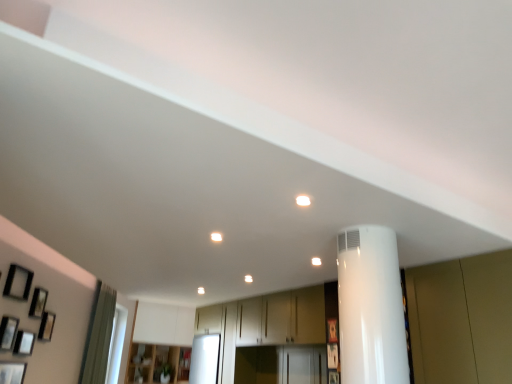
The width and height of the screenshot is (512, 384). What are the coordinates of `white glossy water heater at right` in the screenshot? It's located at (371, 308).

What do you see at coordinates (332, 330) in the screenshot? I see `wooden picture frame at center, which is the first picture frame from right to left` at bounding box center [332, 330].

In order to click on wooden picture frame at center, which is the first picture frame from right to left in this screenshot , I will do `click(332, 330)`.

What do you see at coordinates (18, 282) in the screenshot? I see `matte black picture frame at left, the 6th picture frame viewed from the left` at bounding box center [18, 282].

At what (x,y) coordinates should I click in order to perform the action: click on matte black picture frame at lower left, placed as the 1th picture frame when sorted from left to right. Please return your answer as a coordinate pair (x, y). This screenshot has height=384, width=512. Looking at the image, I should click on (12, 372).

You are a GUI agent. You are given a task and a screenshot of the screen. Output one action in this format:
    pyautogui.click(x=<x>, y=<y>)
    Task: Click on the white glossy water heater at right
    
    Given the screenshot: What is the action you would take?
    pyautogui.click(x=371, y=308)

Is white glossy water heater at right wider or thinner than matte black picture frame at left, which is the fourth picture frame in left-to-right order?

Considering their sizes, white glossy water heater at right looks broader than matte black picture frame at left, which is the fourth picture frame in left-to-right order.

Looking at this image, is white glossy water heater at right next to matte black picture frame at left, which is the fourth picture frame in left-to-right order?

white glossy water heater at right and matte black picture frame at left, which is the fourth picture frame in left-to-right order, are clearly separated.

Image resolution: width=512 pixels, height=384 pixels. What are the coordinates of `water heater in front of the matte black picture frame at left, which is the fourth picture frame in left-to-right order` in the screenshot? It's located at (371, 308).

Measure the distance between white glossy water heater at right and matte black picture frame at left, which is the fourth picture frame in left-to-right order.

A distance of 7.65 feet exists between white glossy water heater at right and matte black picture frame at left, which is the fourth picture frame in left-to-right order.

In the image, is wooden picture frame at lower left, arranged as the second picture frame when viewed from the left, positioned in front of or behind white glossy water heater at right?

Clearly, wooden picture frame at lower left, arranged as the second picture frame when viewed from the left, is behind white glossy water heater at right.

Could you tell me if wooden picture frame at lower left, arranged as the 7th picture frame when viewed from the right, is facing white glossy water heater at right?

Yes, wooden picture frame at lower left, arranged as the 7th picture frame when viewed from the right, faces towards white glossy water heater at right.

From the picture: From the image's perspective, does wooden picture frame at lower left, arranged as the 7th picture frame when viewed from the right, appear higher than white glossy water heater at right?

No, from the image's perspective, wooden picture frame at lower left, arranged as the 7th picture frame when viewed from the right, is not on top of white glossy water heater at right.

Based on their sizes in the image, would you say wooden picture frame at lower left, arranged as the 7th picture frame when viewed from the right, is bigger or smaller than white glossy water heater at right?

Clearly, wooden picture frame at lower left, arranged as the 7th picture frame when viewed from the right, is smaller in size than white glossy water heater at right.

The width and height of the screenshot is (512, 384). What are the coordinates of `the 1st picture frame below when counting from the wooden picture frame at lower left, arranged as the second picture frame when viewed from the left (from the image's perspective)` in the screenshot? It's located at (x=332, y=330).

Is wooden picture frame at lower left, arranged as the 7th picture frame when viewed from the right, oriented towards wooden picture frame at center, which is the eighth picture frame from left to right?

Yes, wooden picture frame at lower left, arranged as the 7th picture frame when viewed from the right, is turned towards wooden picture frame at center, which is the eighth picture frame from left to right.

Which of these two, wooden picture frame at lower left, arranged as the 7th picture frame when viewed from the right, or wooden picture frame at center, which is the first picture frame from right to left, stands taller?

Standing taller between the two is wooden picture frame at lower left, arranged as the 7th picture frame when viewed from the right.

Can you confirm if wooden picture frame at lower left, arranged as the 7th picture frame when viewed from the right, is positioned to the left of wooden picture frame at center, which is the eighth picture frame from left to right?

Yes.

Between matte black picture frame at left, which is the fourth picture frame in left-to-right order, and wooden cabinet at center, which one has larger width?

wooden cabinet at center.

Is wooden cabinet at center completely or partially inside matte black picture frame at left, acting as the fifth picture frame starting from the right?

That's incorrect, wooden cabinet at center is not inside matte black picture frame at left, acting as the fifth picture frame starting from the right.

Is matte black picture frame at left, acting as the fifth picture frame starting from the right, taller or shorter than wooden cabinet at center?

In the image, matte black picture frame at left, acting as the fifth picture frame starting from the right, appears to be shorter than wooden cabinet at center.

In the scene shown: Considering the relative sizes of matte black picture frame at lower left, placed as the 1th picture frame when sorted from left to right, and wooden picture frame at lower right, which appears as the second picture frame when viewed from the right, in the image provided, is matte black picture frame at lower left, placed as the 1th picture frame when sorted from left to right, taller than wooden picture frame at lower right, which appears as the second picture frame when viewed from the right,?

Yes, matte black picture frame at lower left, placed as the 1th picture frame when sorted from left to right, is taller than wooden picture frame at lower right, which appears as the second picture frame when viewed from the right.

Is matte black picture frame at lower left, placed as the 1th picture frame when sorted from left to right, looking in the opposite direction of wooden picture frame at lower right, which appears as the second picture frame when viewed from the right?

No, matte black picture frame at lower left, placed as the 1th picture frame when sorted from left to right, is not facing the opposite direction of wooden picture frame at lower right, which appears as the second picture frame when viewed from the right.

How distant is matte black picture frame at lower left, placed as the 1th picture frame when sorted from left to right, from wooden picture frame at lower right, arranged as the 7th picture frame when viewed from the left?

7.01 feet.

Looking at this image, is matte black picture frame at lower left, placed as the 1th picture frame when sorted from left to right, far away from wooden picture frame at lower right, which appears as the second picture frame when viewed from the right?

Absolutely, matte black picture frame at lower left, placed as the 1th picture frame when sorted from left to right, is distant from wooden picture frame at lower right, which appears as the second picture frame when viewed from the right.

Considering the positions of objects wooden cabinet at center and white glossy water heater at right in the image provided, who is more to the left, wooden cabinet at center or white glossy water heater at right?

wooden cabinet at center is more to the left.

From the image's perspective, would you say wooden cabinet at center is shown under white glossy water heater at right?

Indeed, from the image's perspective, wooden cabinet at center is shown beneath white glossy water heater at right.

Which of these two, wooden cabinet at center or white glossy water heater at right, is wider?

wooden cabinet at center is wider.

Does point (177, 378) come farther from viewer compared to point (352, 358)?

Yes, it is behind point (352, 358).

Is wooden picture frame at center, which is the first picture frame from right to left, at the right side of white glossy water heater at right?

Correct, you'll find wooden picture frame at center, which is the first picture frame from right to left, to the right of white glossy water heater at right.

Is white glossy water heater at right a part of wooden picture frame at center, which is the first picture frame from right to left?

No, white glossy water heater at right is not surrounded by wooden picture frame at center, which is the first picture frame from right to left.

From the image's perspective, is wooden picture frame at center, which is the eighth picture frame from left to right, above white glossy water heater at right?

No.

At what (x,y) coordinates should I click in order to perform the action: click on water heater that appears on the right of matte black picture frame at left, which is the fourth picture frame in left-to-right order. Please return your answer as a coordinate pair (x, y). This screenshot has height=384, width=512. Looking at the image, I should click on (371, 308).

Find the location of a particular element. water heater that is above the wooden picture frame at lower left, arranged as the 7th picture frame when viewed from the right (from a real-world perspective) is located at coordinates (371, 308).

From the image, which object appears to be nearer to wooden picture frame at lower right, arranged as the 7th picture frame when viewed from the left, matte black picture frame at lower left, arranged as the 8th picture frame when viewed from the right, or wooden picture frame at left, the fifth picture frame in the left-to-right sequence?

matte black picture frame at lower left, arranged as the 8th picture frame when viewed from the right, is positioned closer to the anchor wooden picture frame at lower right, arranged as the 7th picture frame when viewed from the left.

Considering their positions, is wooden picture frame at left, the fifth picture frame in the left-to-right sequence, positioned further to matte black picture frame at lower left, arranged as the 8th picture frame when viewed from the right, than wooden picture frame at lower right, which appears as the second picture frame when viewed from the right?

wooden picture frame at lower right, which appears as the second picture frame when viewed from the right, lies further to matte black picture frame at lower left, arranged as the 8th picture frame when viewed from the right, than the other object.

Looking at the image, which one is located closer to wooden picture frame at center, which is the first picture frame from right to left, wooden cabinet at center or matte black picture frame at lower left, arranged as the 8th picture frame when viewed from the right?

Among the two, matte black picture frame at lower left, arranged as the 8th picture frame when viewed from the right, is located nearer to wooden picture frame at center, which is the first picture frame from right to left.

When comparing their distances from wooden picture frame at lower left, arranged as the 7th picture frame when viewed from the right, does wooden picture frame at left, the fourth picture frame when ordered from right to left, or matte black picture frame at left, which is the fourth picture frame in left-to-right order, seem further?

wooden picture frame at left, the fourth picture frame when ordered from right to left.

Looking at the image, which one is located closer to wooden picture frame at lower right, which appears as the second picture frame when viewed from the right, wooden picture frame at lower left, arranged as the 7th picture frame when viewed from the right, or white glossy water heater at right?

The object closer to wooden picture frame at lower right, which appears as the second picture frame when viewed from the right, is white glossy water heater at right.

Looking at the image, which one is located closer to wooden cabinet at center, matte black picture frame at lower left, placed as the 1th picture frame when sorted from left to right, or wooden picture frame at center, which is the first picture frame from right to left?

matte black picture frame at lower left, placed as the 1th picture frame when sorted from left to right, is closer to wooden cabinet at center.

Estimate the real-world distances between objects in this image. Which object is further from matte black picture frame at lower left, arranged as the 8th picture frame when viewed from the right, matte black picture frame at left, the 3th picture frame in the right-to-left sequence, or white glossy water heater at right?

The object further to matte black picture frame at lower left, arranged as the 8th picture frame when viewed from the right, is white glossy water heater at right.

Looking at this image, looking at the image, which one is located closer to matte black picture frame at lower left, arranged as the 8th picture frame when viewed from the right, wooden cabinet at center or matte black picture frame at left, which is the fourth picture frame in left-to-right order?

Among the two, matte black picture frame at left, which is the fourth picture frame in left-to-right order, is located nearer to matte black picture frame at lower left, arranged as the 8th picture frame when viewed from the right.

Identify the location of water heater situated between matte black picture frame at lower left, arranged as the 8th picture frame when viewed from the right, and wooden picture frame at center, which is the eighth picture frame from left to right, from left to right. The height and width of the screenshot is (384, 512). (371, 308).

Where is `water heater between matte black picture frame at left, the 3th picture frame in the right-to-left sequence, and wooden picture frame at center, which is the first picture frame from right to left`? water heater between matte black picture frame at left, the 3th picture frame in the right-to-left sequence, and wooden picture frame at center, which is the first picture frame from right to left is located at coordinates click(x=371, y=308).

Where is `water heater situated between matte black picture frame at left, which is the fourth picture frame in left-to-right order, and wooden picture frame at center, which is the first picture frame from right to left, from left to right`? The image size is (512, 384). water heater situated between matte black picture frame at left, which is the fourth picture frame in left-to-right order, and wooden picture frame at center, which is the first picture frame from right to left, from left to right is located at coordinates (371, 308).

You are a GUI agent. You are given a task and a screenshot of the screen. Output one action in this format:
    pyautogui.click(x=<x>, y=<y>)
    Task: Click on the water heater between wooden picture frame at left, the fourth picture frame when ordered from right to left, and wooden picture frame at center, which is the eighth picture frame from left to right, from left to right
    The width and height of the screenshot is (512, 384).
    Given the screenshot: What is the action you would take?
    tap(371, 308)